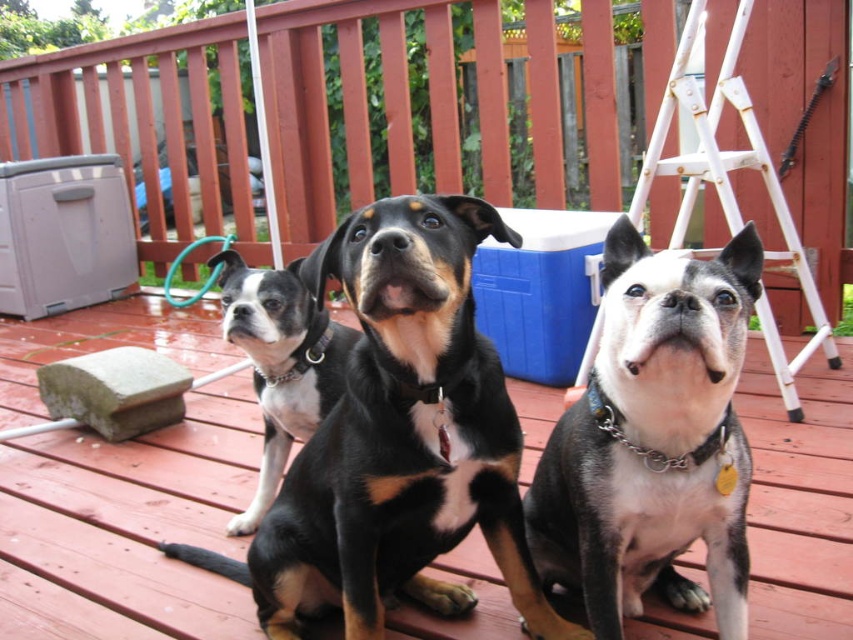
Between black shiny dog at center and white-furred dog at center, which one is positioned higher?

white-furred dog at center

Is point (531, 604) behind point (650, 285)?

Yes, it is behind point (650, 285).

I want to click on black shiny dog at center, so click(398, 438).

Describe the element at coordinates (398, 438) in the screenshot. Image resolution: width=853 pixels, height=640 pixels. I see `black shiny dog at center` at that location.

Between point (395, 403) and point (666, 170), which one is positioned behind?

Point (666, 170)

This screenshot has width=853, height=640. In order to click on black shiny dog at center in this screenshot , I will do `click(398, 438)`.

Measure the distance from white-furred dog at center to black and white fur at center.

A distance of 68.38 centimeters exists between white-furred dog at center and black and white fur at center.

Between white-furred dog at center and black and white fur at center, which one appears on the right side from the viewer's perspective?

Positioned to the right is white-furred dog at center.

Find the location of a particular element. white-furred dog at center is located at coordinates (653, 440).